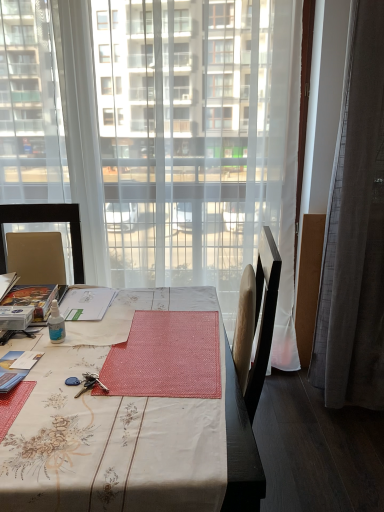
At what (x,y) coordinates should I click in order to perform the action: click on vacant area that lies to the right of transparent plastic bottle at table center. Please return your answer as a coordinate pair (x, y). This screenshot has width=384, height=512. Looking at the image, I should click on (113, 338).